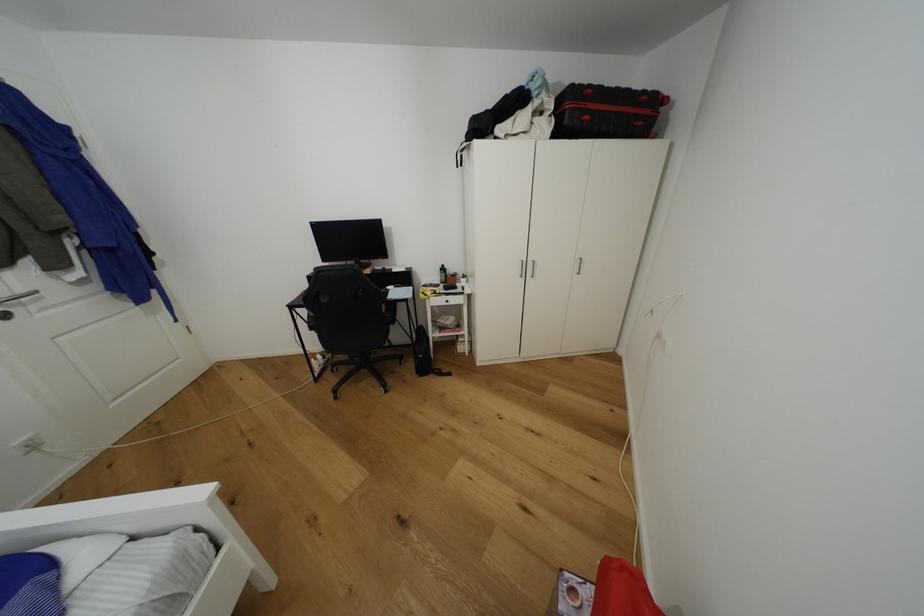
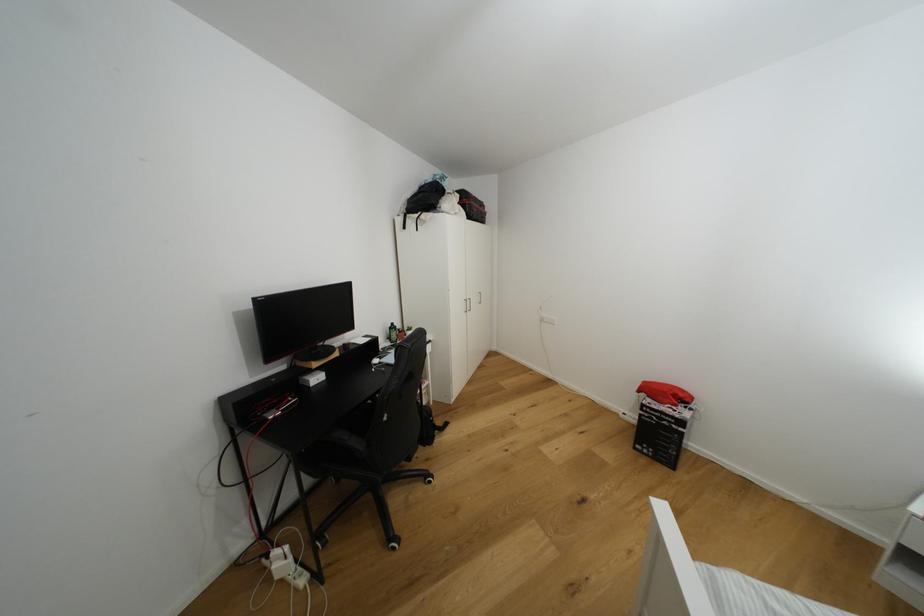
Find the pixel in the second image that matches (446,270) in the first image.

(395, 330)